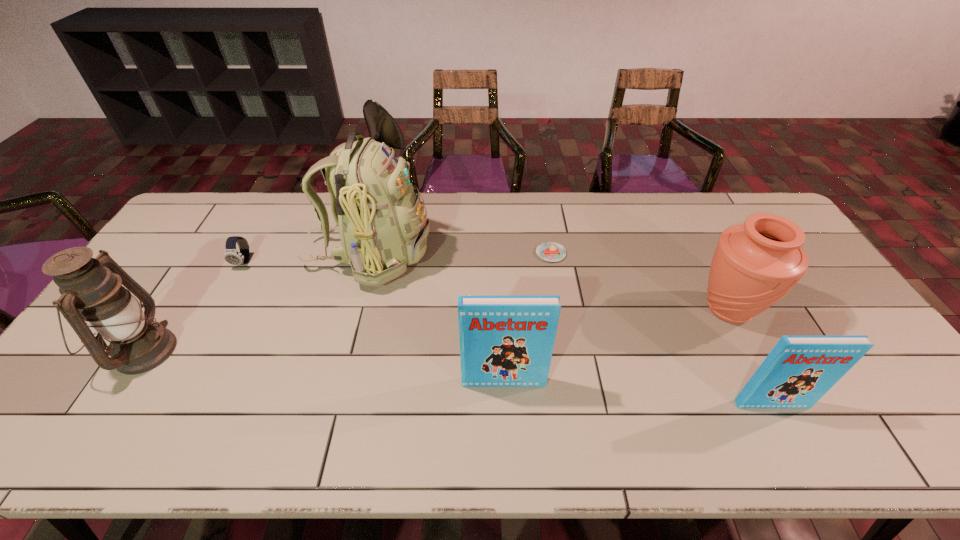
Given the evenly spaced books in the image, where should an extra book be added on the left to preserve the spacing? Please point to a vacant space. Please provide its 2D coordinates. Your answer should be formatted as a tuple, i.e. [(x, y)], where the tuple contains the x and y coordinates of a point satisfying the conditions above.

[(256, 361)]